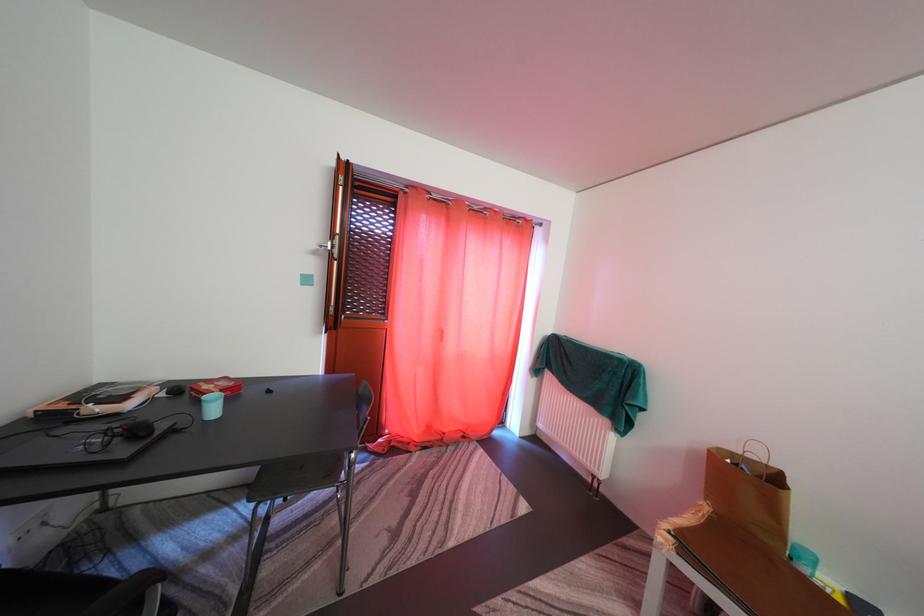
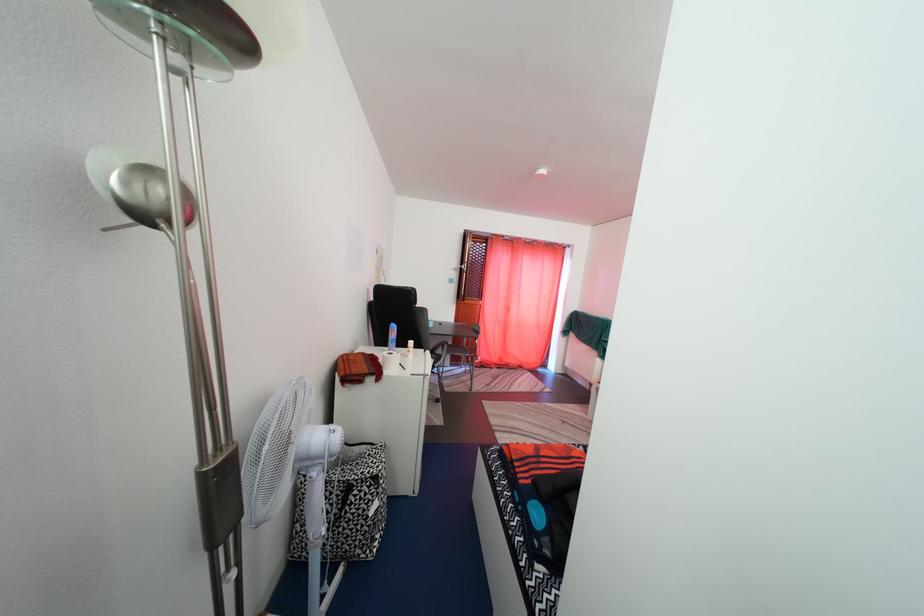
Locate, in the second image, the point that corresponds to [448,342] in the first image.

(517, 315)